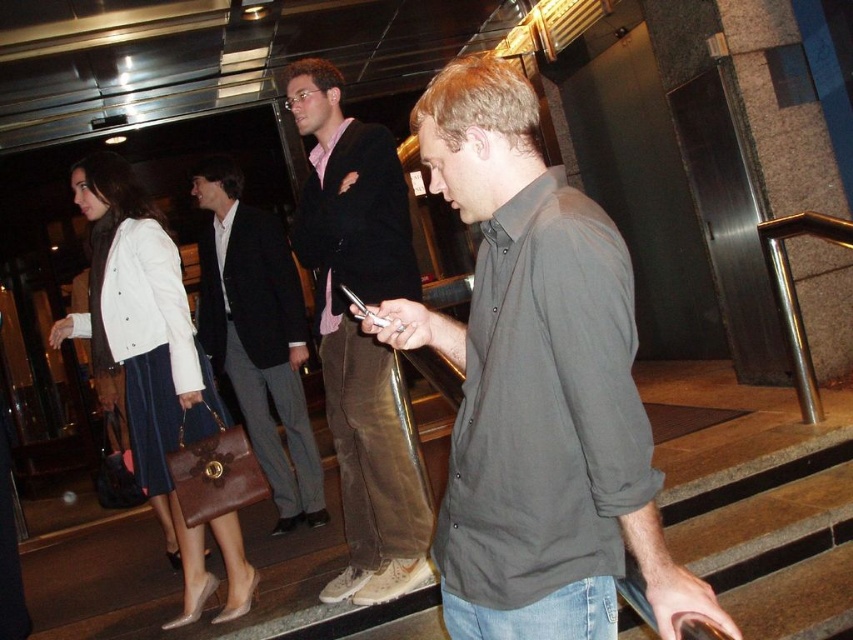
From the picture: You are a security guard at the building and need to check the size of the items carried by the exiting individuals. The brown suede pants at center and the dark brown leather briefcase at center are both in the center of the image. Which item is larger?

The dark brown leather briefcase at center is larger than the brown suede pants at center.

You are a fashion designer analyzing the image. The gray matte shirt at center and brown suede pants at center are part of an outfit. Which item has a larger width measurement?

The gray matte shirt at center has a larger width measurement than the brown suede pants at center, as stated in the description.